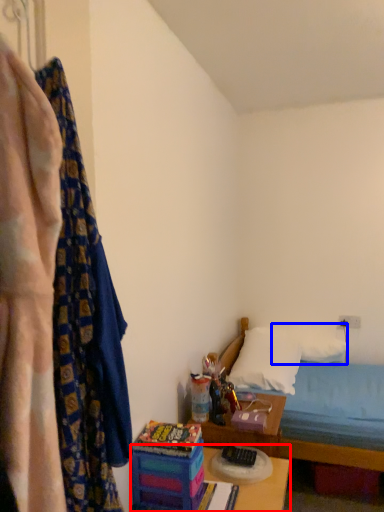
Question: Which point is further to the camera, table (highlighted by a red box) or pillow (highlighted by a blue box)?

Choices:
 (A) table
 (B) pillow

Answer: (B)